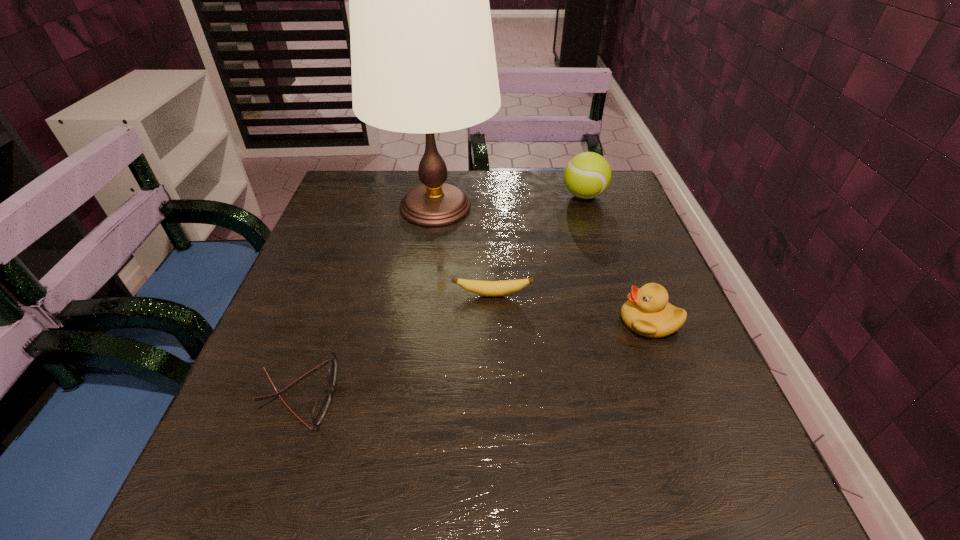
What are the coordinates of `free point between the nearest object and the fourth farthest object` in the screenshot? It's located at (474, 357).

Where is `free space between the lamp and the third farthest object`? This screenshot has height=540, width=960. free space between the lamp and the third farthest object is located at coordinates (465, 251).

Where is `free space between the tennis ball and the nearest object`? The width and height of the screenshot is (960, 540). free space between the tennis ball and the nearest object is located at coordinates pyautogui.click(x=442, y=295).

Locate an element on the screen. empty space that is in between the fourth shortest object and the lamp is located at coordinates (510, 201).

At what (x,y) coordinates should I click in order to perform the action: click on vacant space in between the lamp and the fourth shortest object. Please return your answer as a coordinate pair (x, y). Looking at the image, I should click on coord(510,201).

Find the location of `free area in between the third farthest object and the spectacles`. free area in between the third farthest object and the spectacles is located at coordinates (396, 344).

Find the location of a particular element. Image resolution: width=960 pixels, height=540 pixels. free space between the duckling and the second tallest object is located at coordinates (616, 259).

This screenshot has height=540, width=960. I want to click on vacant region between the nearest object and the third farthest object, so tap(396, 344).

The height and width of the screenshot is (540, 960). I want to click on the fourth closest object relative to the tallest object, so click(x=320, y=408).

I want to click on object that is the third closest to the third nearest object, so click(320, 408).